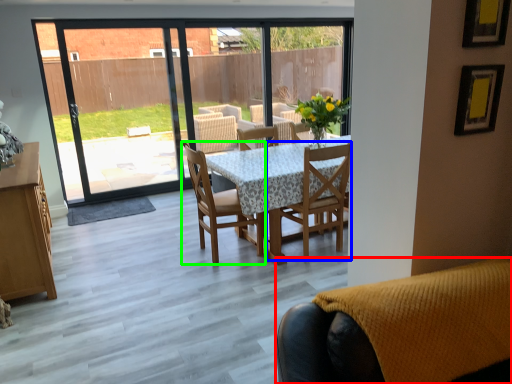
Question: Based on their relative distances, which object is farther from chair (highlighted by a red box)? Choose from chair (highlighted by a blue box) and chair (highlighted by a green box).

Choices:
 (A) chair
 (B) chair

Answer: (B)